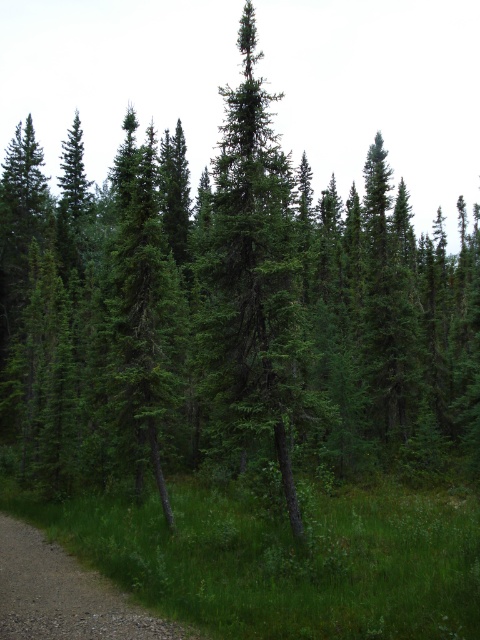
Question: Among these points, which one is nearest to the camera?

Choices:
 (A) (27, 552)
 (B) (231, 179)

Answer: (B)

Question: Which point is closer to the camera?

Choices:
 (A) brown gravel path at lower left
 (B) green needle-like at center

Answer: (A)

Question: Can you confirm if green needle-like at center is positioned to the left of brown gravel path at lower left?

Choices:
 (A) no
 (B) yes

Answer: (A)

Question: Is green needle-like at center wider than brown gravel path at lower left?

Choices:
 (A) no
 (B) yes

Answer: (A)

Question: Is green needle-like at center positioned at the back of brown gravel path at lower left?

Choices:
 (A) yes
 (B) no

Answer: (A)